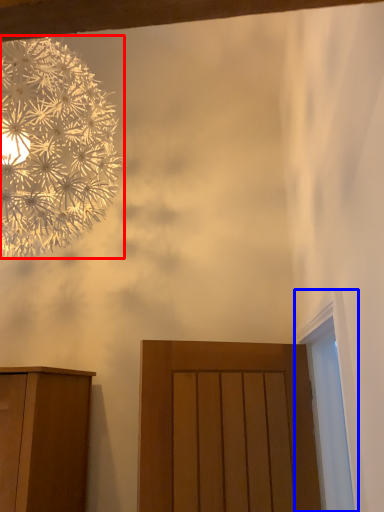
Question: Which point is further to the camera, flower (highlighted by a red box) or window (highlighted by a blue box)?

Choices:
 (A) flower
 (B) window

Answer: (A)